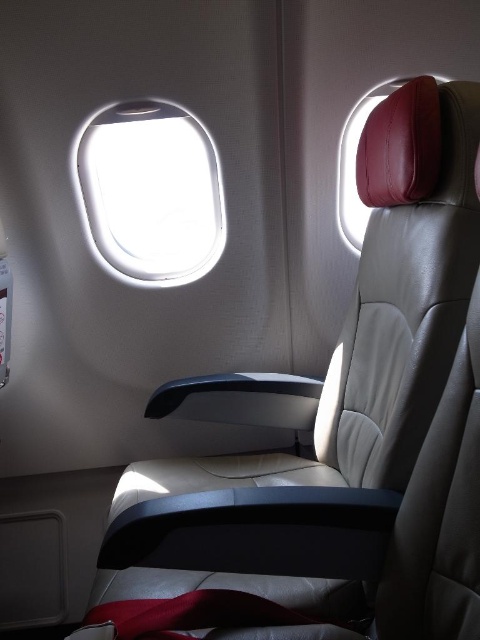
In the scene shown: You are a passenger seated in the airplane cabin. You want to reach a point marked at coordinates point (x=208, y=253). If your arms can extend 5.5 feet, can you reach that point?

The point (x=208, y=253) is 6.31 feet away from you, which is beyond your arm reach of 5.5 feet. You cannot reach it.

You are a flight attendant carrying a 20 inch tray. You need to pass through the space between the transparent glass airplane window at upper center and the leather headrest at upper right. Can your tray fit through this space?

The distance between the transparent glass airplane window at upper center and the leather headrest at upper right is 22.36 inches. Since the tray is 20 inches wide, it can fit through the space as there is enough clearance.

You are sitting in the airplane seat and looking forward. Which object, the transparent glass airplane window at upper center or the leather headrest at upper right, is taller?

The transparent glass airplane window at upper center is taller than the leather headrest at upper right according to the description.